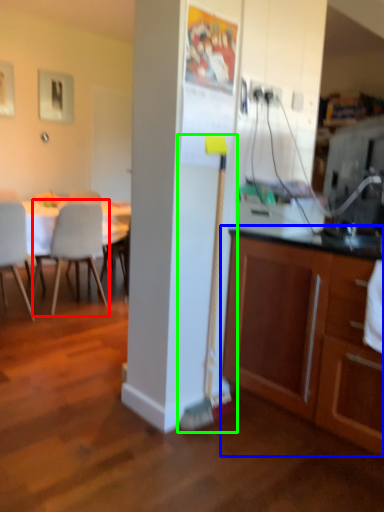
Question: Estimate the real-world distances between objects in this image. Which object is closer to chair (highlighted by a red box), cabinetry (highlighted by a blue box) or brush (highlighted by a green box)?

Choices:
 (A) cabinetry
 (B) brush

Answer: (B)